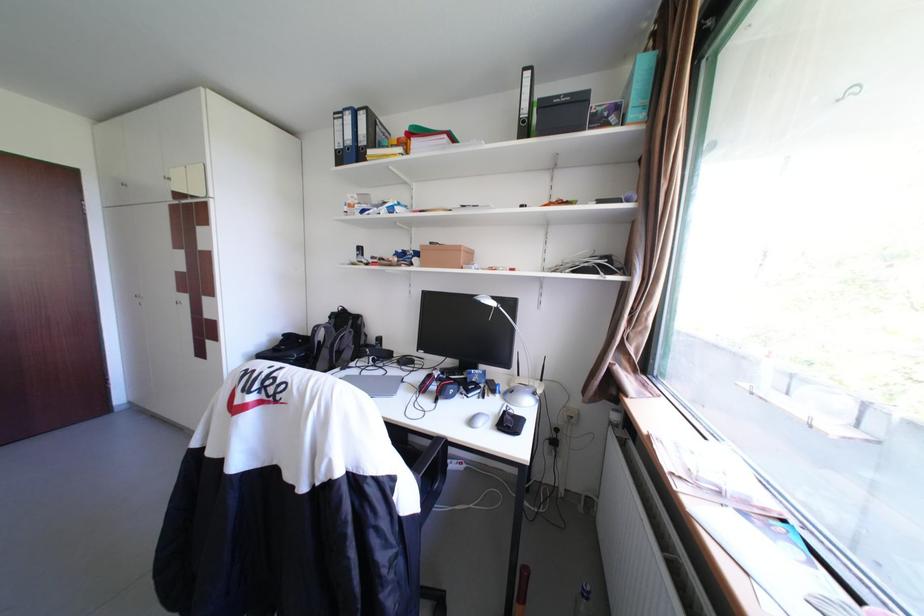
At what (x,y) coordinates should I click in order to perform the action: click on white router antenna. Please return your answer as a coordinate pair (x, y). The height and width of the screenshot is (616, 924). Looking at the image, I should click on (523, 386).